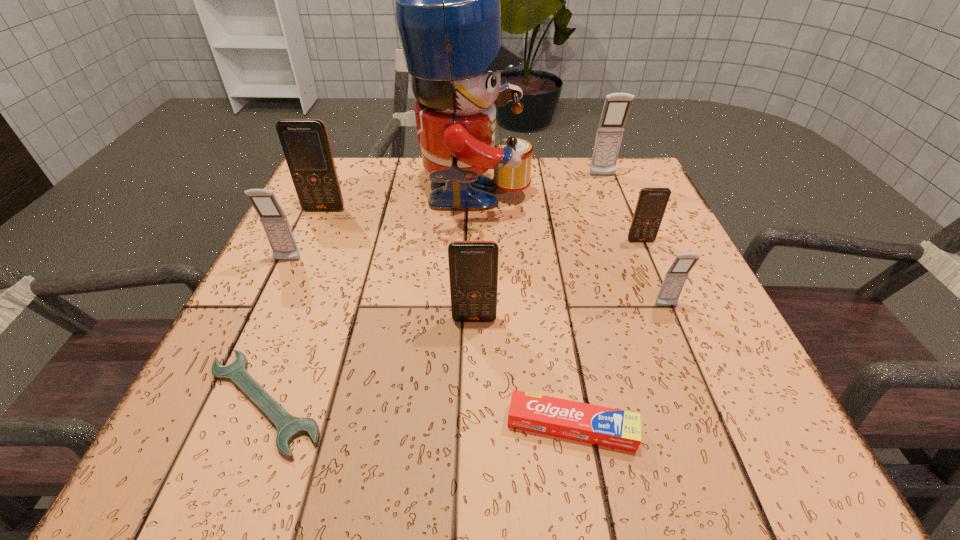
Locate an element on the screen. Image resolution: width=960 pixels, height=540 pixels. the second closest cellular telephone to the nearest gray cellular telephone is located at coordinates (473, 265).

This screenshot has height=540, width=960. Find the location of `the fifth closest cellular telephone to the nearest gray cellular telephone`. the fifth closest cellular telephone to the nearest gray cellular telephone is located at coordinates (305, 143).

Locate which gray cellular telephone is the second closest to the fourth nearest cellular telephone. Please provide its 2D coordinates. Your answer should be formatted as a tuple, i.e. [(x, y)], where the tuple contains the x and y coordinates of a point satisfying the conditions above.

[(616, 108)]

This screenshot has width=960, height=540. Find the location of `the second closest gray cellular telephone to the second nearest cellular telephone`. the second closest gray cellular telephone to the second nearest cellular telephone is located at coordinates (274, 221).

Locate which orange cellular telephone ranks in proximity to the second farthest cellular telephone. Please provide its 2D coordinates. Your answer should be formatted as a tuple, i.e. [(x, y)], where the tuple contains the x and y coordinates of a point satisfying the conditions above.

[(473, 265)]

Select which orange cellular telephone is the second closest to the fifth nearest object. Please provide its 2D coordinates. Your answer should be formatted as a tuple, i.e. [(x, y)], where the tuple contains the x and y coordinates of a point satisfying the conditions above.

[(473, 265)]

Locate an element on the screen. The height and width of the screenshot is (540, 960). vacant space that satisfies the following two spatial constraints: 1. on the screen of the nearest cellular telephone; 2. on the left side of the second shortest object is located at coordinates (473, 426).

This screenshot has height=540, width=960. Find the location of `free location that satisfies the following two spatial constraints: 1. on the screen of the second farthest cellular telephone; 2. on the left side of the shortest object`. free location that satisfies the following two spatial constraints: 1. on the screen of the second farthest cellular telephone; 2. on the left side of the shortest object is located at coordinates (237, 402).